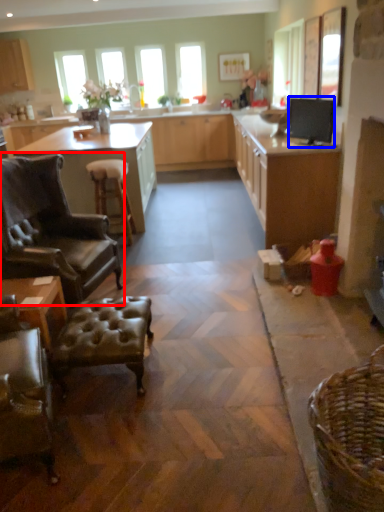
Question: Which object appears closest to the camera in this image, chair (highlighted by a red box) or appliance (highlighted by a blue box)?

Choices:
 (A) chair
 (B) appliance

Answer: (A)